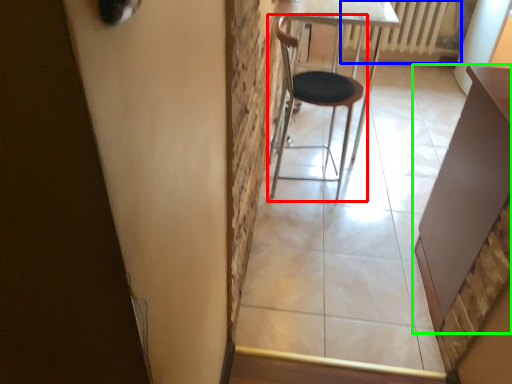
Question: Which object is the farthest from chair (highlighted by a red box)? Choose among these: radiator (highlighted by a blue box) or table (highlighted by a green box).

Choices:
 (A) radiator
 (B) table

Answer: (A)